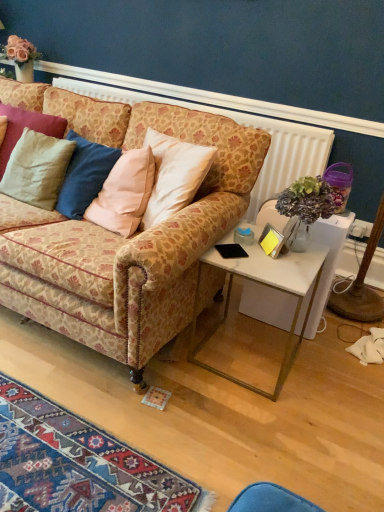
Locate an element on the screen. This screenshot has width=384, height=512. free space to the right of white marble side table at right is located at coordinates (332, 373).